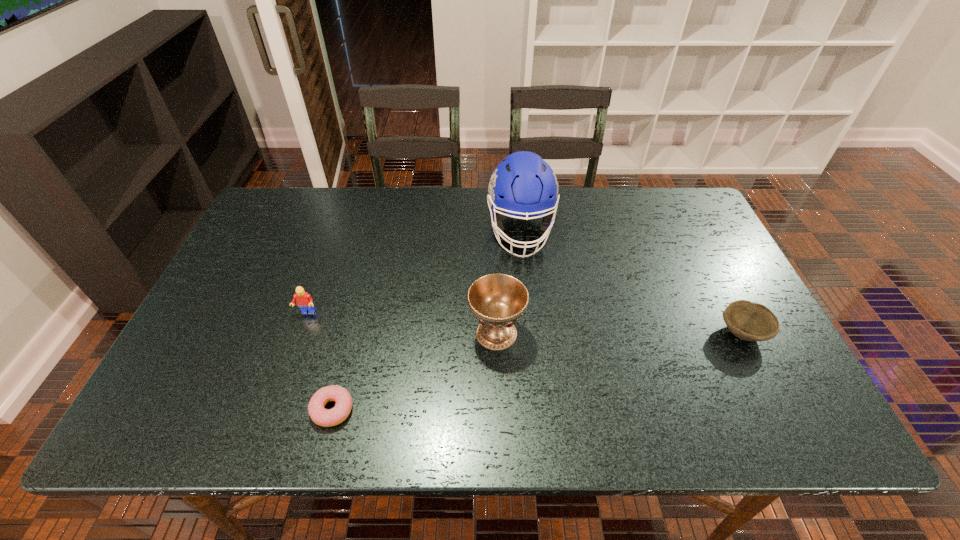
I want to click on the tallest object, so click(523, 184).

I want to click on the farthest object, so (523, 184).

This screenshot has height=540, width=960. What are the coordinates of `chalice` in the screenshot? It's located at (497, 300).

This screenshot has height=540, width=960. I want to click on the leftmost object, so click(304, 301).

Locate an element on the screen. Image resolution: width=960 pixels, height=540 pixels. the third shortest object is located at coordinates (304, 301).

The width and height of the screenshot is (960, 540). Find the location of `the rightmost object`. the rightmost object is located at coordinates (749, 321).

This screenshot has height=540, width=960. I want to click on the second shortest object, so click(749, 321).

The width and height of the screenshot is (960, 540). I want to click on doughnut, so click(323, 417).

Locate an element on the screen. The width and height of the screenshot is (960, 540). the fourth object from right to left is located at coordinates (323, 417).

Identify the location of blank space located on the face guard of the football helmet. (533, 356).